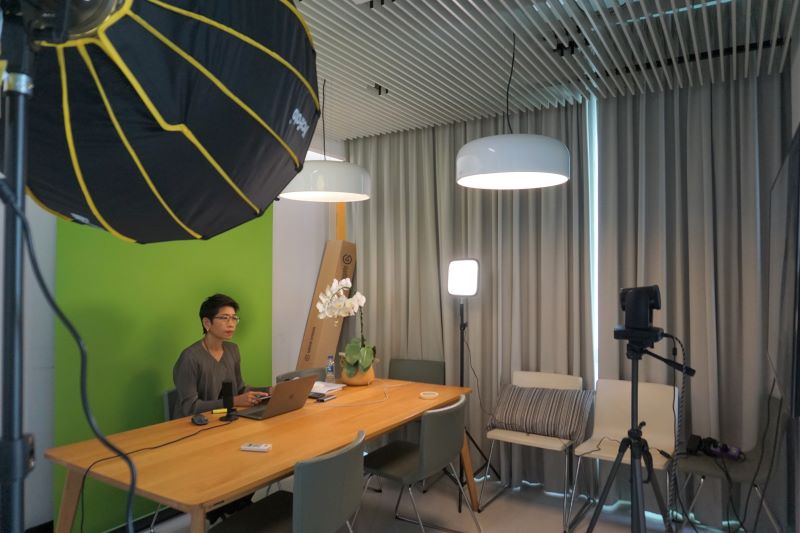
The image size is (800, 533). Find the location of `either fake or real plant / flower`. either fake or real plant / flower is located at coordinates (357, 360).